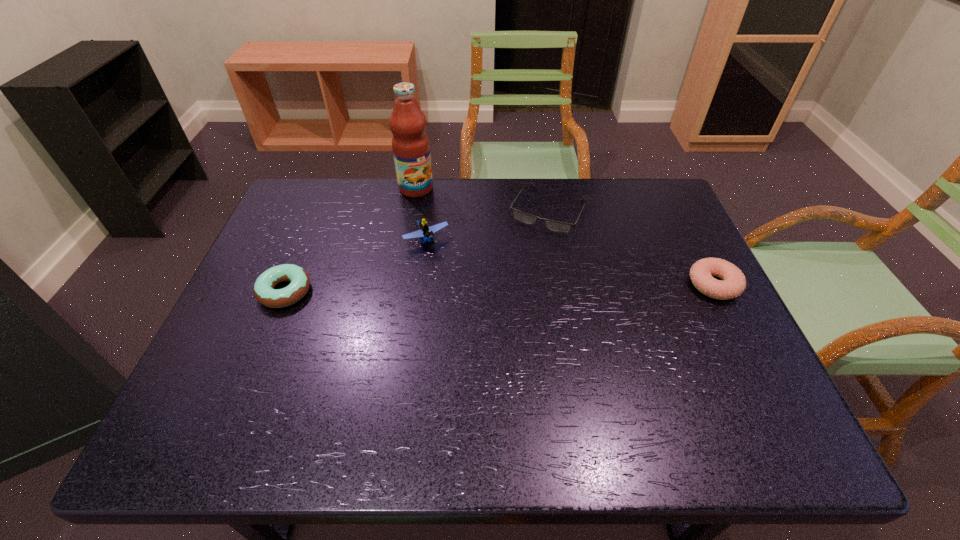
Where is `blank area located on the front-facing side of the second tallest object`? Image resolution: width=960 pixels, height=540 pixels. blank area located on the front-facing side of the second tallest object is located at coordinates (495, 343).

This screenshot has height=540, width=960. What are the coordinates of `vacant space positioned on the front-facing side of the second tallest object` in the screenshot? It's located at pos(495,343).

Where is `free location located on the front-facing side of the second tallest object`? The width and height of the screenshot is (960, 540). free location located on the front-facing side of the second tallest object is located at coordinates (456, 283).

Find the location of a particular element. Image resolution: width=960 pixels, height=540 pixels. vacant region located 0.390m on the front label of the fruit juice is located at coordinates (488, 274).

Locate an element on the screen. This screenshot has width=960, height=540. free space located on the front label of the fruit juice is located at coordinates (470, 254).

This screenshot has width=960, height=540. Identify the location of vacant space located on the front label of the fruit juice. (488, 274).

Locate an element on the screen. spectacles that is at the far edge is located at coordinates (524, 217).

Identify the location of fruit juice that is positioned at the far edge. Image resolution: width=960 pixels, height=540 pixels. (410, 144).

Locate an element on the screen. object present at the left edge is located at coordinates (264, 291).

You are a GUI agent. You are given a task and a screenshot of the screen. Output one action in this format:
    pyautogui.click(x=<x>, y=<y>)
    Task: Click on the object located in the right edge section of the desktop
    
    Given the screenshot: What is the action you would take?
    pyautogui.click(x=734, y=282)